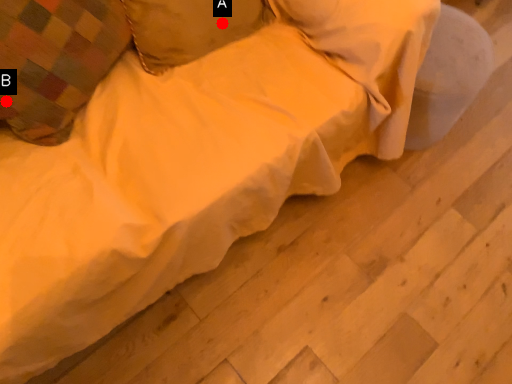
Question: Two points are circled on the image, labeled by A and B beside each circle. Which point is farther from the camera taking this photo?

Choices:
 (A) A is further
 (B) B is further

Answer: (A)